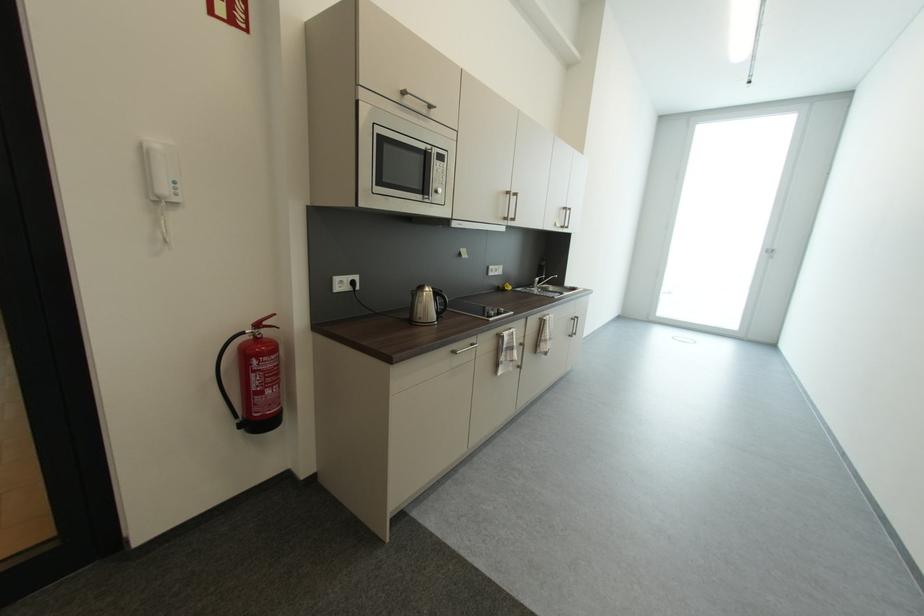
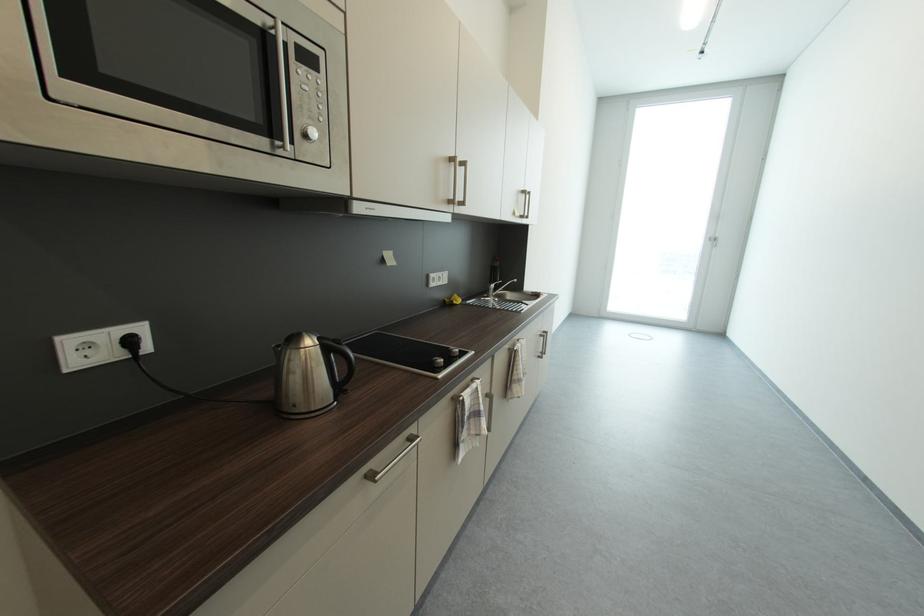
Find the pixel in the second image that matches (446,192) in the first image.

(321, 134)